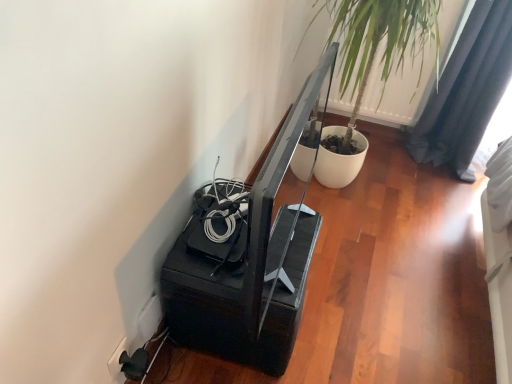
Describe the element at coordinates (116, 358) in the screenshot. This screenshot has height=384, width=512. I see `white plastic electric outlet at lower left, the first electric outlet when ordered from left to right` at that location.

Locate an element on the screen. This screenshot has width=512, height=384. dark gray fabric curtain at upper right is located at coordinates (467, 91).

Between green leafy plant at upper right and dark gray fabric curtain at upper right, which one has smaller size?

green leafy plant at upper right.

Is green leafy plant at upper right turned away from dark gray fabric curtain at upper right?

green leafy plant at upper right does not have its back to dark gray fabric curtain at upper right.

From a real-world perspective, is green leafy plant at upper right located beneath dark gray fabric curtain at upper right?

No.

You are a GUI agent. You are given a task and a screenshot of the screen. Output one action in this format:
    pyautogui.click(x=<x>, y=<y>)
    Task: Click on the curtain behind the white plastic electric outlet at lower left, the 2th electric outlet in the left-to-right sequence
    Image resolution: width=512 pixels, height=384 pixels.
    Given the screenshot: What is the action you would take?
    [467, 91]

Does dark gray fabric curtain at upper right touch white plastic electric outlet at lower left, the 1th electric outlet viewed from the right?

dark gray fabric curtain at upper right is not next to white plastic electric outlet at lower left, the 1th electric outlet viewed from the right, and they're not touching.

Measure the distance from dark gray fabric curtain at upper right to white plastic electric outlet at lower left, the 2th electric outlet in the left-to-right sequence.

The distance of dark gray fabric curtain at upper right from white plastic electric outlet at lower left, the 2th electric outlet in the left-to-right sequence, is 1.72 meters.

From a real-world perspective, is dark gray fabric curtain at upper right under white plastic electric outlet at lower left, the 2th electric outlet in the left-to-right sequence?

No, from a real-world perspective, dark gray fabric curtain at upper right is not below white plastic electric outlet at lower left, the 2th electric outlet in the left-to-right sequence.

Which is more to the left, green leafy plant at upper right or white plastic electric outlet at lower left, the 2th electric outlet in the left-to-right sequence?

Positioned to the left is white plastic electric outlet at lower left, the 2th electric outlet in the left-to-right sequence.

Which of these two, green leafy plant at upper right or white plastic electric outlet at lower left, the 2th electric outlet in the left-to-right sequence, is thinner?

white plastic electric outlet at lower left, the 2th electric outlet in the left-to-right sequence.

Who is taller, green leafy plant at upper right or white plastic electric outlet at lower left, the 1th electric outlet viewed from the right?

green leafy plant at upper right.

Are dark gray fabric curtain at upper right and green leafy plant at upper right located far from each other?

No.

From the image's perspective, who appears lower, dark gray fabric curtain at upper right or green leafy plant at upper right?

dark gray fabric curtain at upper right.

Do you think dark gray fabric curtain at upper right is within green leafy plant at upper right, or outside of it?

dark gray fabric curtain at upper right lies outside green leafy plant at upper right.

From a real-world perspective, which is physically above, white plastic electric outlet at lower left, arranged as the 2th electric outlet when viewed from the right, or white plastic electric outlet at lower left, the 1th electric outlet viewed from the right?

In real-world perspective, white plastic electric outlet at lower left, arranged as the 2th electric outlet when viewed from the right, is above.

Is white plastic electric outlet at lower left, arranged as the 2th electric outlet when viewed from the right, surrounding white plastic electric outlet at lower left, the 1th electric outlet viewed from the right?

That's incorrect, white plastic electric outlet at lower left, the 1th electric outlet viewed from the right, is not inside white plastic electric outlet at lower left, arranged as the 2th electric outlet when viewed from the right.

Can you tell me how much white plastic electric outlet at lower left, the first electric outlet when ordered from left to right, and white plastic electric outlet at lower left, the 2th electric outlet in the left-to-right sequence, differ in facing direction?

They differ by 0.00853 degrees in their facing directions.

Does green leafy plant at upper right have a smaller size compared to white plastic electric outlet at lower left, the first electric outlet when ordered from left to right?

Incorrect, green leafy plant at upper right is not smaller in size than white plastic electric outlet at lower left, the first electric outlet when ordered from left to right.

Considering the positions of objects green leafy plant at upper right and white plastic electric outlet at lower left, the first electric outlet when ordered from left to right, in the image provided, who is in front, green leafy plant at upper right or white plastic electric outlet at lower left, the first electric outlet when ordered from left to right,?

white plastic electric outlet at lower left, the first electric outlet when ordered from left to right, is closer to the camera.

From the image's perspective, between green leafy plant at upper right and white plastic electric outlet at lower left, arranged as the 2th electric outlet when viewed from the right, who is located below?

white plastic electric outlet at lower left, arranged as the 2th electric outlet when viewed from the right, from the image's perspective.

Is white plastic electric outlet at lower left, arranged as the 2th electric outlet when viewed from the right, in contact with dark gray fabric curtain at upper right?

They are not placed beside each other.

Who is taller, white plastic electric outlet at lower left, arranged as the 2th electric outlet when viewed from the right, or dark gray fabric curtain at upper right?

dark gray fabric curtain at upper right.

Is white plastic electric outlet at lower left, arranged as the 2th electric outlet when viewed from the right, in front of or behind dark gray fabric curtain at upper right in the image?

white plastic electric outlet at lower left, arranged as the 2th electric outlet when viewed from the right, is in front of dark gray fabric curtain at upper right.

Find the location of a particular element. The image size is (512, 384). houseplant lying behind the dark gray fabric curtain at upper right is located at coordinates (380, 39).

Locate an element on the screen. This screenshot has height=384, width=512. curtain above the white plastic electric outlet at lower left, the 1th electric outlet viewed from the right (from the image's perspective) is located at coordinates (467, 91).

Considering their positions, is dark gray fabric curtain at upper right positioned closer to white plastic electric outlet at lower left, the 2th electric outlet in the left-to-right sequence, than green leafy plant at upper right?

green leafy plant at upper right is positioned closer to the anchor white plastic electric outlet at lower left, the 2th electric outlet in the left-to-right sequence.

From the image, which object appears to be farther from green leafy plant at upper right, white plastic electric outlet at lower left, the 2th electric outlet in the left-to-right sequence, or white plastic electric outlet at lower left, the first electric outlet when ordered from left to right?

Among the two, white plastic electric outlet at lower left, the first electric outlet when ordered from left to right, is located further to green leafy plant at upper right.

Based on their spatial positions, is green leafy plant at upper right or dark gray fabric curtain at upper right closer to white plastic electric outlet at lower left, arranged as the 2th electric outlet when viewed from the right?

green leafy plant at upper right lies closer to white plastic electric outlet at lower left, arranged as the 2th electric outlet when viewed from the right, than the other object.

Looking at the image, which one is located closer to green leafy plant at upper right, dark gray fabric curtain at upper right or white plastic electric outlet at lower left, arranged as the 2th electric outlet when viewed from the right?

dark gray fabric curtain at upper right.

In the scene shown: Estimate the real-world distances between objects in this image. Which object is closer to dark gray fabric curtain at upper right, white plastic electric outlet at lower left, the 1th electric outlet viewed from the right, or white plastic electric outlet at lower left, arranged as the 2th electric outlet when viewed from the right?

Based on the image, white plastic electric outlet at lower left, the 1th electric outlet viewed from the right, appears to be nearer to dark gray fabric curtain at upper right.

From the image, which object appears to be farther from dark gray fabric curtain at upper right, green leafy plant at upper right or white plastic electric outlet at lower left, the 1th electric outlet viewed from the right?

white plastic electric outlet at lower left, the 1th electric outlet viewed from the right, is further to dark gray fabric curtain at upper right.

Which object lies nearer to the anchor point white plastic electric outlet at lower left, the first electric outlet when ordered from left to right, white plastic electric outlet at lower left, the 2th electric outlet in the left-to-right sequence, or dark gray fabric curtain at upper right?

white plastic electric outlet at lower left, the 2th electric outlet in the left-to-right sequence, is closer to white plastic electric outlet at lower left, the first electric outlet when ordered from left to right.

Based on their spatial positions, is white plastic electric outlet at lower left, the 1th electric outlet viewed from the right, or green leafy plant at upper right further from white plastic electric outlet at lower left, arranged as the 2th electric outlet when viewed from the right?

green leafy plant at upper right is further to white plastic electric outlet at lower left, arranged as the 2th electric outlet when viewed from the right.

This screenshot has height=384, width=512. In order to click on houseplant located between white plastic electric outlet at lower left, the 1th electric outlet viewed from the right, and dark gray fabric curtain at upper right in the left-right direction in this screenshot , I will do `click(380, 39)`.

Locate an element on the screen. electric outlet between white plastic electric outlet at lower left, the first electric outlet when ordered from left to right, and dark gray fabric curtain at upper right from left to right is located at coordinates (149, 318).

Find the location of a particular element. The image size is (512, 384). electric outlet between green leafy plant at upper right and white plastic electric outlet at lower left, arranged as the 2th electric outlet when viewed from the right, vertically is located at coordinates (149, 318).

I want to click on houseplant between white plastic electric outlet at lower left, arranged as the 2th electric outlet when viewed from the right, and dark gray fabric curtain at upper right from left to right, so click(380, 39).